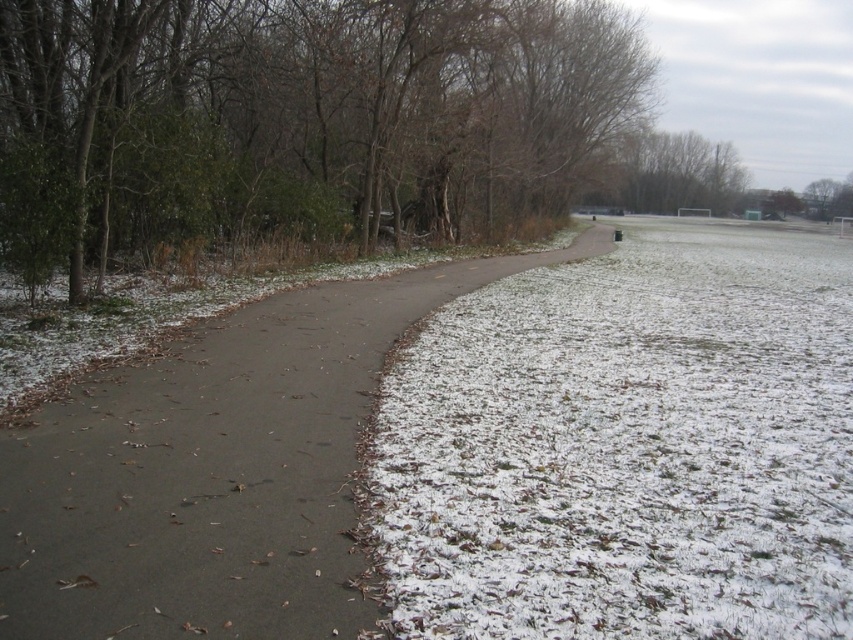
Between point (91, 136) and point (480, 276), which one is positioned behind?

Positioned behind is point (480, 276).

Which is below, green matte tree at left or sandy brown asphalt path at center?

sandy brown asphalt path at center

Who is more forward, (312, 13) or (189, 369)?

Point (189, 369)

Identify the location of green matte tree at left. The image size is (853, 640). (300, 118).